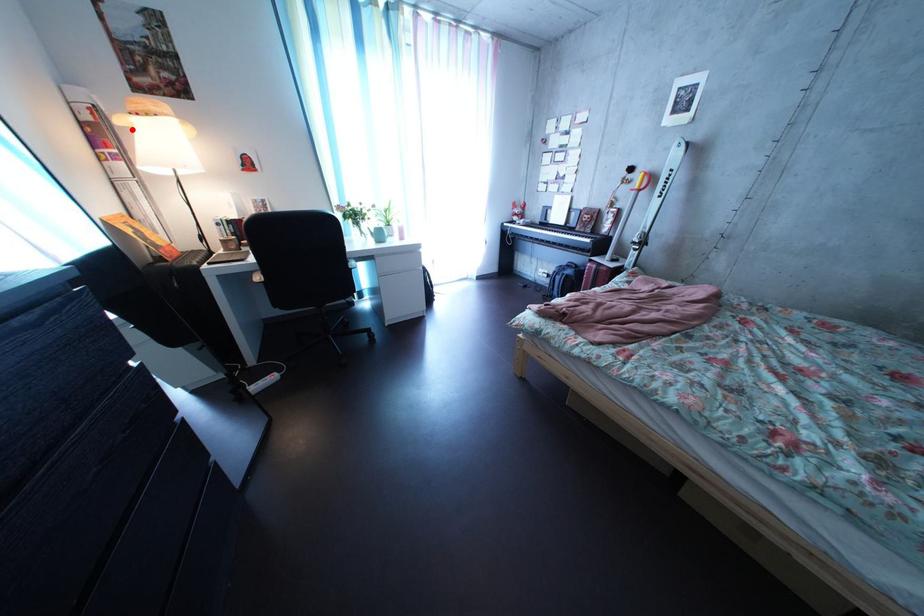
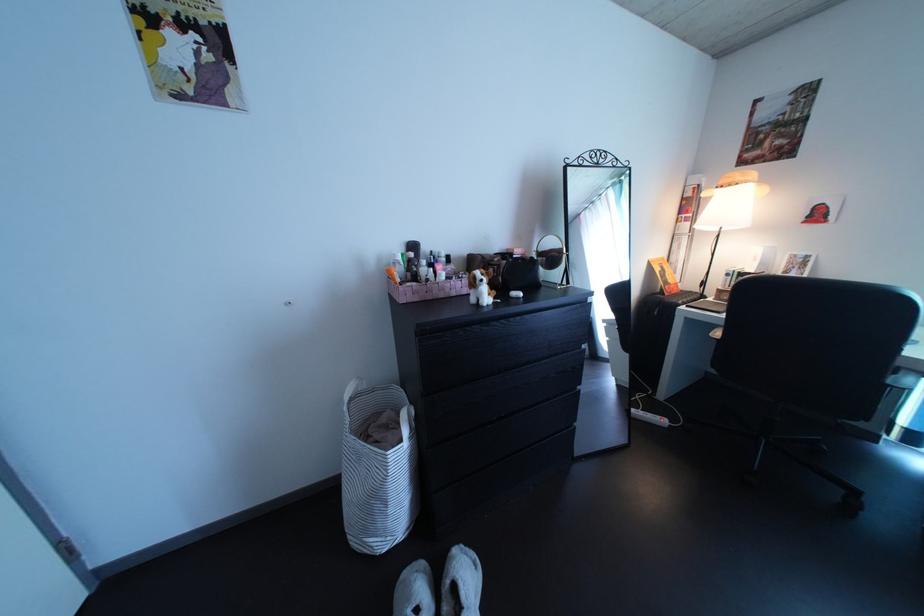
Question: I am providing you with two images of the same scene from different viewpoints. A red point is shown in image1. For the corresponding object point in image2, is it positioned nearer or farther from the camera?

Choices:
 (A) Nearer
 (B) Farther

Answer: (A)